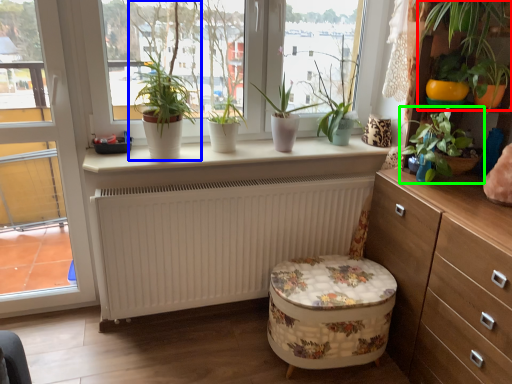
Question: Which object is the farthest from houseplant (highlighted by a red box)? Choose among these: houseplant (highlighted by a blue box) or houseplant (highlighted by a green box).

Choices:
 (A) houseplant
 (B) houseplant

Answer: (A)